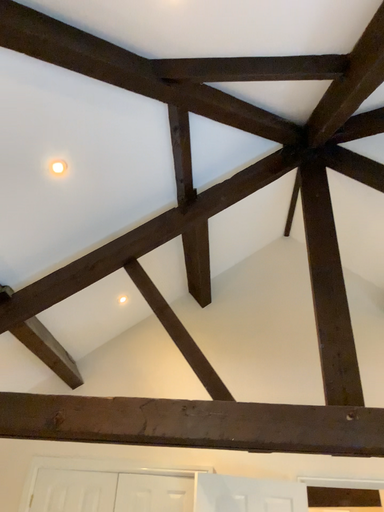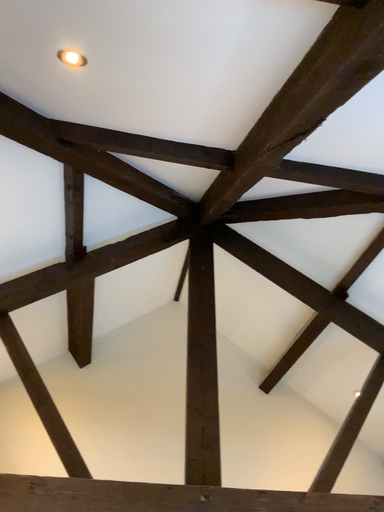
Question: How did the camera likely rotate when shooting the video?

Choices:
 (A) rotated left
 (B) rotated right

Answer: (B)